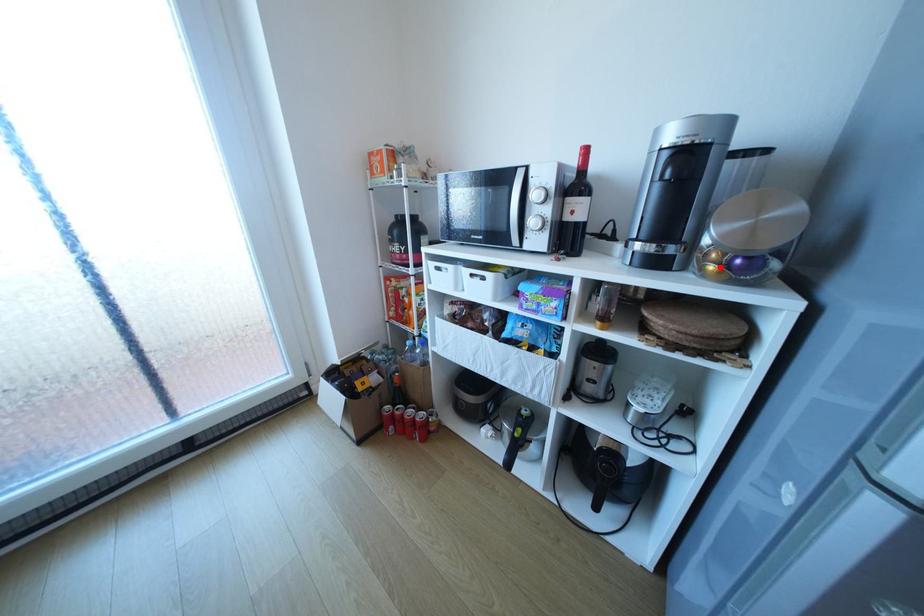
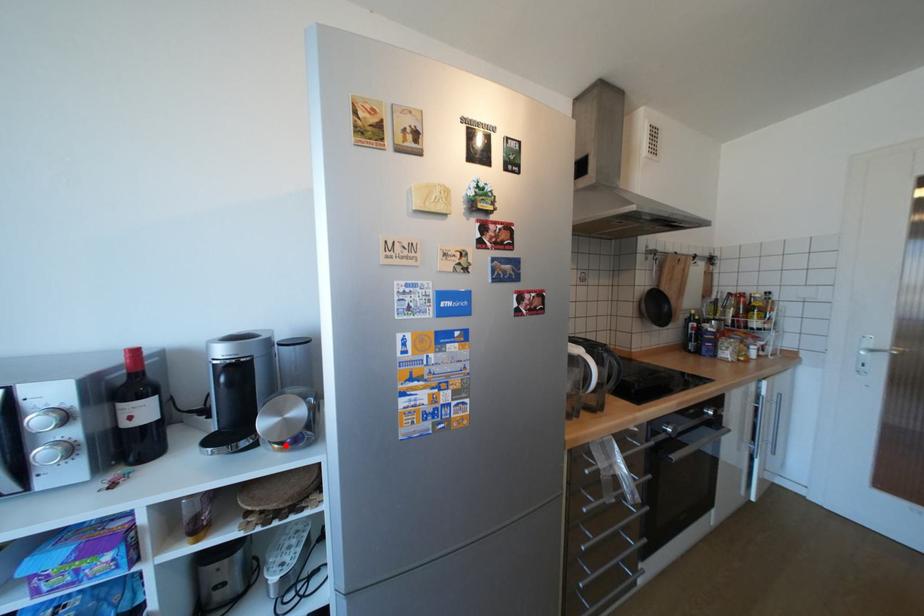
I am providing you with two images of the same scene from different viewpoints. A red point is marked on the first image and another point is marked on the second image. Do the highlighted points in image1 and image2 indicate the same real-world spot?

Yes